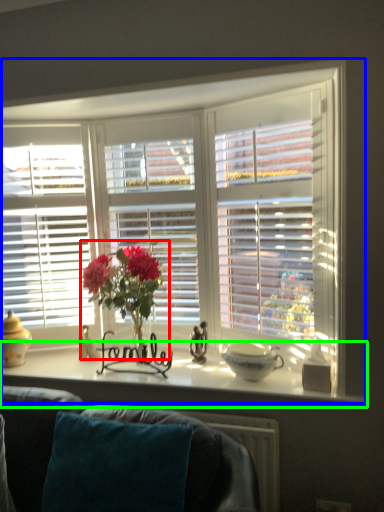
Question: Based on their relative distances, which object is nearer to floral arrangement (highlighted by a red box)? Choose from window (highlighted by a blue box) and window sill (highlighted by a green box).

Choices:
 (A) window
 (B) window sill

Answer: (B)